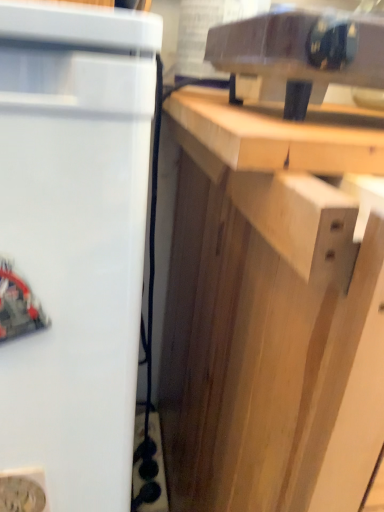
Question: Is light wood cabinet at center wider than light brown wood at upper right?

Choices:
 (A) yes
 (B) no

Answer: (A)

Question: Does light wood cabinet at center have a smaller size compared to light brown wood at upper right?

Choices:
 (A) yes
 (B) no

Answer: (B)

Question: Is light wood cabinet at center at the left side of light brown wood at upper right?

Choices:
 (A) no
 (B) yes

Answer: (A)

Question: Considering the relative sizes of light wood cabinet at center and light brown wood at upper right in the image provided, is light wood cabinet at center thinner than light brown wood at upper right?

Choices:
 (A) yes
 (B) no

Answer: (B)

Question: Is light wood cabinet at center surrounding light brown wood at upper right?

Choices:
 (A) no
 (B) yes

Answer: (A)

Question: Is light wood cabinet at center shorter than light brown wood at upper right?

Choices:
 (A) no
 (B) yes

Answer: (A)

Question: Is light brown wood at upper right looking in the opposite direction of white matte refrigerator at left?

Choices:
 (A) yes
 (B) no

Answer: (B)

Question: Considering the relative sizes of light brown wood at upper right and white matte refrigerator at left in the image provided, is light brown wood at upper right smaller than white matte refrigerator at left?

Choices:
 (A) yes
 (B) no

Answer: (A)

Question: Can you confirm if light brown wood at upper right is thinner than white matte refrigerator at left?

Choices:
 (A) yes
 (B) no

Answer: (B)

Question: Is light brown wood at upper right closer to camera compared to white matte refrigerator at left?

Choices:
 (A) no
 (B) yes

Answer: (A)

Question: Is light brown wood at upper right not near white matte refrigerator at left?

Choices:
 (A) no
 (B) yes

Answer: (A)

Question: Are light brown wood at upper right and white matte refrigerator at left making contact?

Choices:
 (A) yes
 (B) no

Answer: (B)

Question: Can we say light wood cabinet at center lies outside white matte refrigerator at left?

Choices:
 (A) no
 (B) yes

Answer: (B)